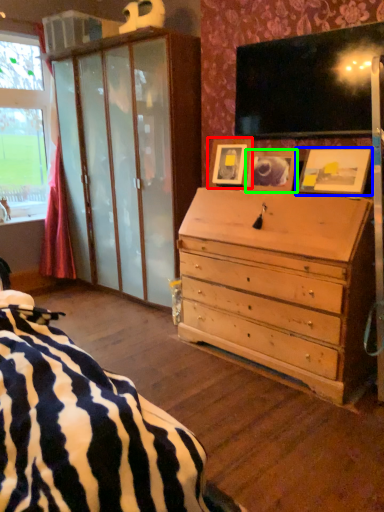
Question: Which object is positioned farthest from picture frame (highlighted by a red box)? Select from picture frame (highlighted by a blue box) and picture frame (highlighted by a green box).

Choices:
 (A) picture frame
 (B) picture frame

Answer: (A)